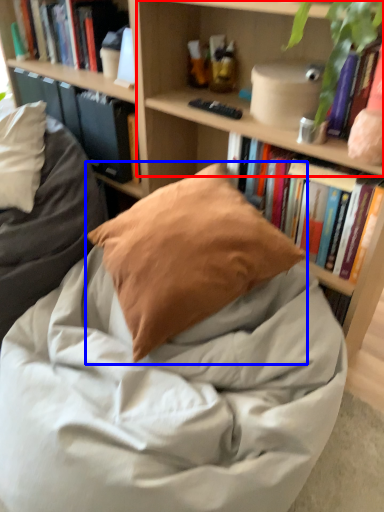
Question: Which object appears closest to the camera in this image, shelf (highlighted by a red box) or pillow (highlighted by a blue box)?

Choices:
 (A) shelf
 (B) pillow

Answer: (A)